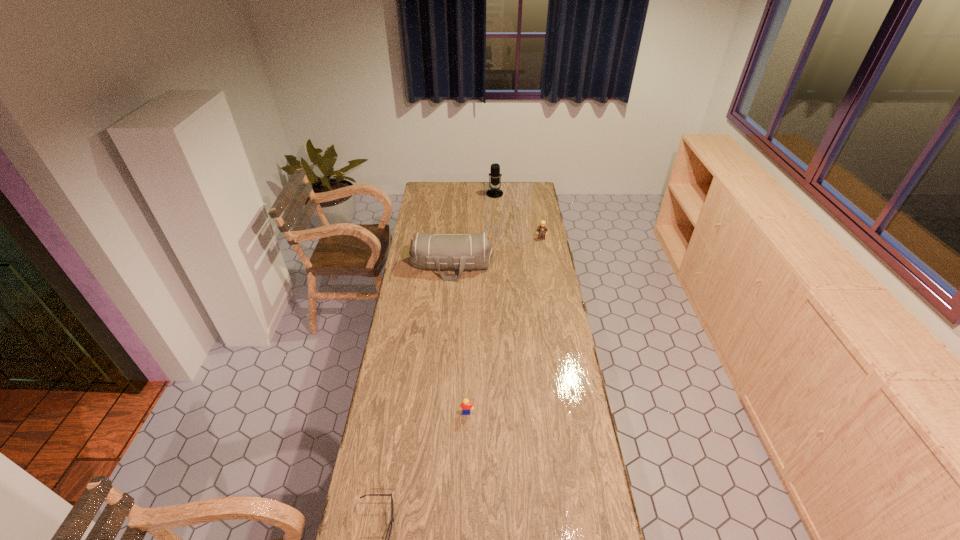
Where is `microphone`? This screenshot has width=960, height=540. microphone is located at coordinates (495, 174).

This screenshot has height=540, width=960. I want to click on the tallest object, so click(x=495, y=174).

Identify the location of the third nearest object. (438, 251).

Identify the location of duffel bag. (438, 251).

Find the location of a particular element. This screenshot has height=540, width=960. the third tallest object is located at coordinates (542, 229).

You are a GUI agent. You are given a task and a screenshot of the screen. Output one action in this format:
    pyautogui.click(x=<x>, y=<y>)
    Task: Click on the second farthest object
    The width and height of the screenshot is (960, 540).
    Given the screenshot: What is the action you would take?
    pyautogui.click(x=542, y=229)

At what (x,y) coordinates should I click in order to perform the action: click on the second shortest object. Please return your answer as a coordinate pair (x, y). This screenshot has height=540, width=960. Looking at the image, I should click on (466, 405).

Locate an element on the screen. the fourth farthest object is located at coordinates (466, 405).

Image resolution: width=960 pixels, height=540 pixels. Identify the location of free space located 0.090m on the left of the microphone. (472, 194).

The height and width of the screenshot is (540, 960). Find the location of `vacant space located 0.250m on the front of the duffel bag`. vacant space located 0.250m on the front of the duffel bag is located at coordinates (447, 319).